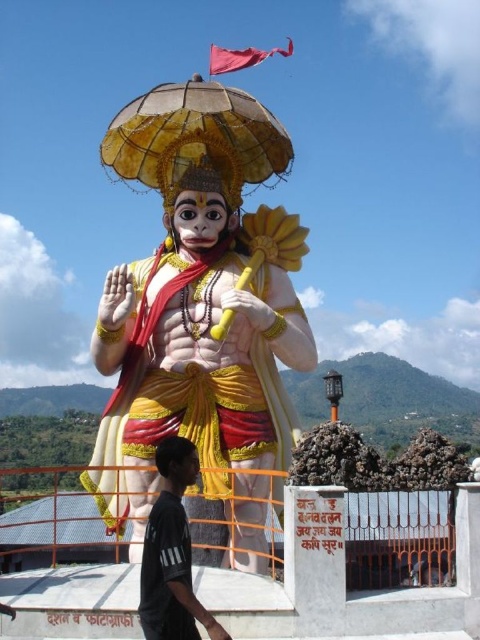
Question: Where is polished gold statue at center located in relation to black cotton shirt at lower left in the image?

Choices:
 (A) below
 (B) above

Answer: (B)

Question: Among these points, which one is nearest to the camera?

Choices:
 (A) (122, 108)
 (B) (160, 572)

Answer: (B)

Question: Is the position of gold textured umbrella at center less distant than that of black cotton shirt at lower left?

Choices:
 (A) no
 (B) yes

Answer: (A)

Question: Based on their relative distances, which object is farther from the gold textured umbrella at center?

Choices:
 (A) polished gold statue at center
 (B) black cotton shirt at lower left

Answer: (B)

Question: Does polished gold statue at center appear under gold textured umbrella at center?

Choices:
 (A) yes
 (B) no

Answer: (A)

Question: Which point appears farthest from the camera in this image?

Choices:
 (A) (203, 624)
 (B) (253, 173)
 (C) (133, 554)

Answer: (B)